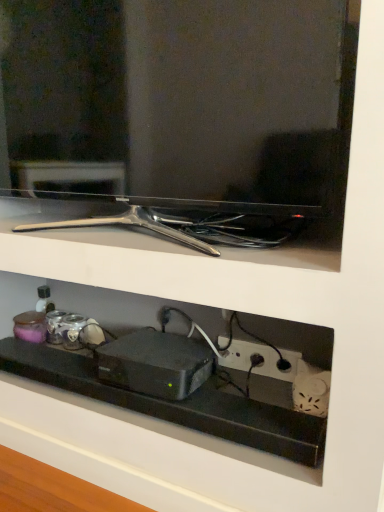
The height and width of the screenshot is (512, 384). I want to click on free location above black plastic shelf at lower center (from a real-world perspective), so click(99, 372).